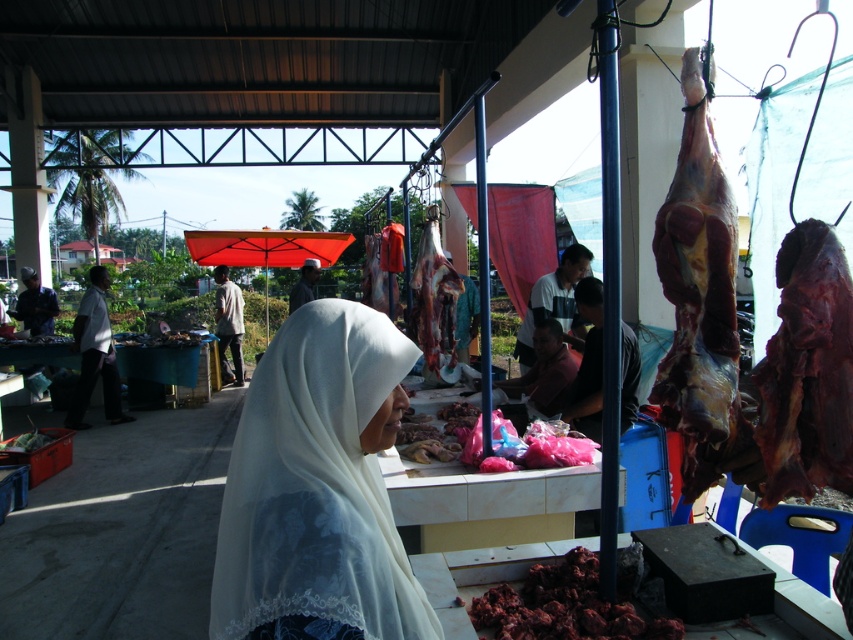
Does point (231, 470) come farther from viewer compared to point (450, 308)?

No.

You are a GUI agent. You are given a task and a screenshot of the screen. Output one action in this format:
    pyautogui.click(x=<x>, y=<y>)
    Task: Click on the white sheer headscarf at center
    This screenshot has height=640, width=853.
    Given the screenshot: What is the action you would take?
    pyautogui.click(x=318, y=488)

This screenshot has height=640, width=853. What do you see at coordinates (807, 371) in the screenshot?
I see `dry brown meat at right` at bounding box center [807, 371].

From the picture: Is dry brown meat at right below white fabric headscarf at center?

Actually, dry brown meat at right is above white fabric headscarf at center.

Which is behind, point (811, 467) or point (80, 308)?

The point (80, 308) is more distant.

This screenshot has height=640, width=853. I want to click on dry brown meat at right, so click(807, 371).

Between dark red meat at lower center and light brown fabric headscarf at center, which one is positioned lower?

Positioned lower is dark red meat at lower center.

In the scene shown: Between dark red meat at lower center and light brown fabric headscarf at center, which one has more height?

With more height is light brown fabric headscarf at center.

Measure the distance between point (596, 600) and camera.

They are 2.22 meters apart.

Image resolution: width=853 pixels, height=640 pixels. I want to click on dark red meat at lower center, so click(x=569, y=604).